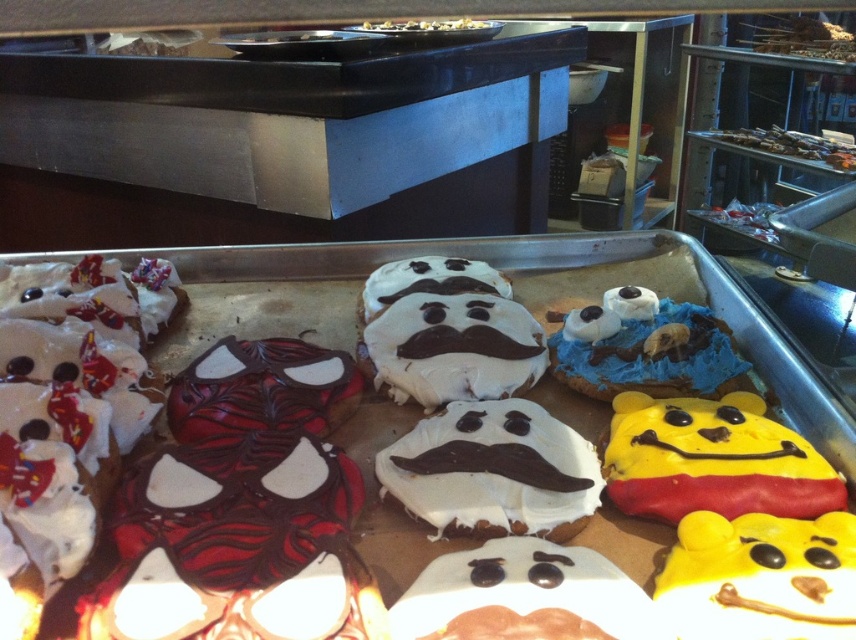
Question: Can you confirm if white chocolate cookie with mustache at center is thinner than shiny chocolate cookies at upper right?

Choices:
 (A) yes
 (B) no

Answer: (A)

Question: Which object is closer to the camera taking this photo?

Choices:
 (A) blue frosted cookie with chocolate eyes and nose at center-right
 (B) white chocolate cookie with mustache at center
 (C) yellow matte winnie the pooh at right

Answer: (C)

Question: Which of these objects is positioned farthest from the shiny chocolate cookies at upper right?

Choices:
 (A) blue frosted cookie with chocolate eyes and nose at center-right
 (B) white chocolate mustache at center
 (C) yellow matte winnie the pooh at right
 (D) white chocolate cookie with mustache at center

Answer: (D)

Question: Which of the following is the closest to the observer?

Choices:
 (A) white chocolate cookie with mustache at center
 (B) white chocolate mustache at center

Answer: (A)

Question: Does white chocolate cookie with mustache at center have a lesser width compared to blue frosted cookie with chocolate eyes and nose at center-right?

Choices:
 (A) no
 (B) yes

Answer: (B)

Question: Does yellow matte winnie the pooh at right have a greater width compared to white chocolate mustache at center?

Choices:
 (A) yes
 (B) no

Answer: (B)